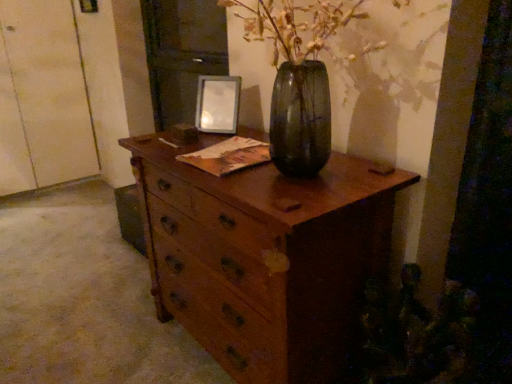
Question: From the image's perspective, is white matte door at left on top of wooden chest of drawers at center?

Choices:
 (A) yes
 (B) no

Answer: (A)

Question: Is white matte door at left further to camera compared to wooden chest of drawers at center?

Choices:
 (A) no
 (B) yes

Answer: (B)

Question: Considering the relative sizes of white matte door at left and wooden chest of drawers at center in the image provided, is white matte door at left wider than wooden chest of drawers at center?

Choices:
 (A) yes
 (B) no

Answer: (B)

Question: Does white matte door at left appear on the left side of wooden chest of drawers at center?

Choices:
 (A) yes
 (B) no

Answer: (A)

Question: Is white matte door at left touching wooden chest of drawers at center?

Choices:
 (A) no
 (B) yes

Answer: (A)

Question: Is white matte door at left facing away from wooden chest of drawers at center?

Choices:
 (A) yes
 (B) no

Answer: (B)

Question: Considering the relative sizes of wooden chest of drawers at center and metallic silver picture frame at upper center in the image provided, is wooden chest of drawers at center thinner than metallic silver picture frame at upper center?

Choices:
 (A) no
 (B) yes

Answer: (A)

Question: Considering the relative sizes of wooden chest of drawers at center and metallic silver picture frame at upper center in the image provided, is wooden chest of drawers at center taller than metallic silver picture frame at upper center?

Choices:
 (A) no
 (B) yes

Answer: (B)

Question: From the image's perspective, is wooden chest of drawers at center located above metallic silver picture frame at upper center?

Choices:
 (A) no
 (B) yes

Answer: (A)

Question: Can you confirm if wooden chest of drawers at center is shorter than metallic silver picture frame at upper center?

Choices:
 (A) yes
 (B) no

Answer: (B)

Question: From a real-world perspective, is wooden chest of drawers at center positioned over metallic silver picture frame at upper center based on gravity?

Choices:
 (A) yes
 (B) no

Answer: (B)

Question: Is metallic silver picture frame at upper center completely or partially inside wooden chest of drawers at center?

Choices:
 (A) yes
 (B) no

Answer: (B)

Question: From the image's perspective, is wooden chest of drawers at center located above white matte door at left?

Choices:
 (A) yes
 (B) no

Answer: (B)